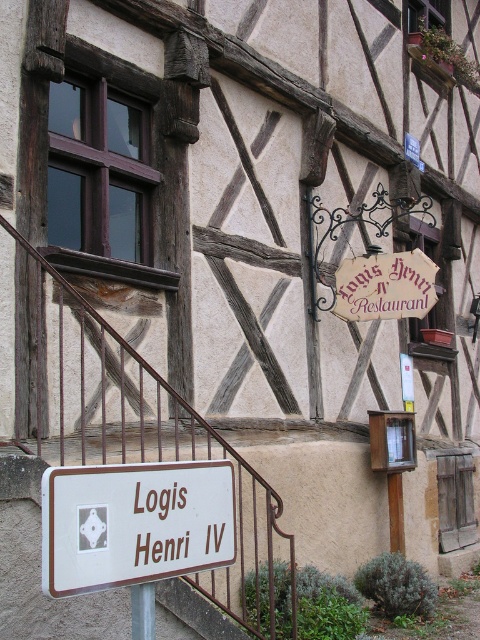
Question: Which of the following is the closest to the observer?

Choices:
 (A) white matte sign at lower center
 (B) brown metal/rail at lower left
 (C) silver metallic pole at lower center
 (D) wooden sign at center-right

Answer: (A)

Question: Is white matte sign at lower center smaller than silver metallic pole at lower center?

Choices:
 (A) no
 (B) yes

Answer: (A)

Question: Does wooden sign at center-right appear on the left side of silver metallic pole at lower center?

Choices:
 (A) yes
 (B) no

Answer: (B)

Question: Does brown metal/rail at lower left have a lesser width compared to silver metallic pole at lower center?

Choices:
 (A) yes
 (B) no

Answer: (B)

Question: Which point is farther to the camera?

Choices:
 (A) white matte sign at lower center
 (B) wooden sign at center-right
 (C) silver metallic pole at lower center
 (D) brown metal/rail at lower left

Answer: (B)

Question: Which object is positioned farthest from the brown metal/rail at lower left?

Choices:
 (A) white matte sign at lower center
 (B) silver metallic pole at lower center
 (C) wooden sign at center-right

Answer: (C)